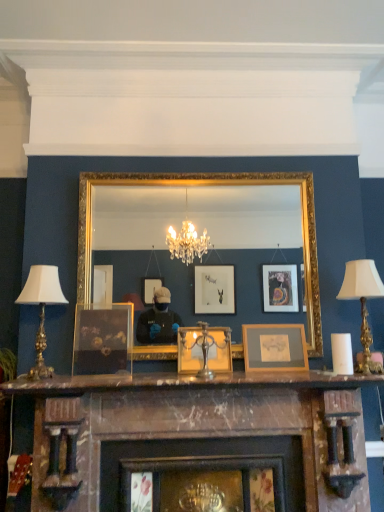
Question: Is wooden picture frame at center, positioned as the third picture frame in left-to-right order, bigger or smaller than metallic gold picture frame at center, which is counted as the 2th picture frame, starting from the right?

Choices:
 (A) small
 (B) big

Answer: (A)

Question: Would you say wooden picture frame at center, positioned as the third picture frame in left-to-right order, is inside or outside metallic gold picture frame at center, which is the second picture frame from left to right?

Choices:
 (A) outside
 (B) inside

Answer: (A)

Question: Based on their relative distances, which object is farther from the marble mantel at center?

Choices:
 (A) silver metallic table lamp at left, the 1th table lamp positioned from the left
 (B) wooden picture frame at center, positioned as the third picture frame in left-to-right order
 (C) white fabric lampshade at right, acting as the 2th table lamp starting from the left
 (D) gold-framed mirror at center
 (E) marble fireplace at center

Answer: (C)

Question: Which of these objects is positioned closest to the silver metallic table lamp at left, the 1th table lamp positioned from the left?

Choices:
 (A) marble fireplace at center
 (B) matte glass picture frame at center, acting as the 3th picture frame starting from the right
 (C) marble mantel at center
 (D) white fabric lampshade at right, the 1th table lamp from the right
 (E) gold-framed mirror at center

Answer: (B)